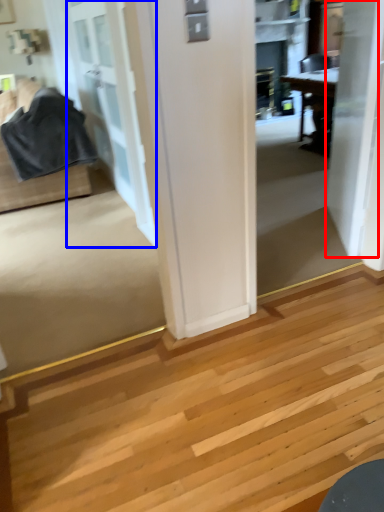
Question: Which of the following is the farthest to the observer, door (highlighted by a red box) or door (highlighted by a blue box)?

Choices:
 (A) door
 (B) door

Answer: (B)